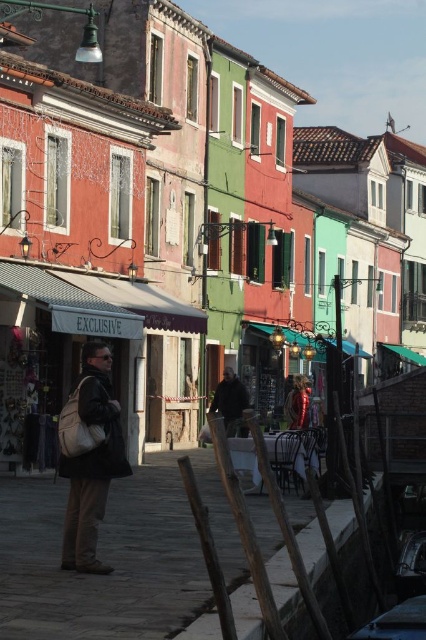
Question: Which point is closer to the camera taking this photo?

Choices:
 (A) (74, 472)
 (B) (238, 390)

Answer: (A)

Question: Does matte black backpack at center appear on the left side of dark gray fabric jacket at center?

Choices:
 (A) no
 (B) yes

Answer: (B)

Question: Which of the following is the farthest from the observer?

Choices:
 (A) matte black backpack at center
 (B) dark gray fabric jacket at center

Answer: (B)

Question: Can you confirm if matte black backpack at center is bigger than dark gray fabric jacket at center?

Choices:
 (A) yes
 (B) no

Answer: (B)

Question: Among these points, which one is farthest from the camera?

Choices:
 (A) (238, 417)
 (B) (106, 435)

Answer: (A)

Question: Is matte black backpack at center positioned at the back of dark gray fabric jacket at center?

Choices:
 (A) no
 (B) yes

Answer: (A)